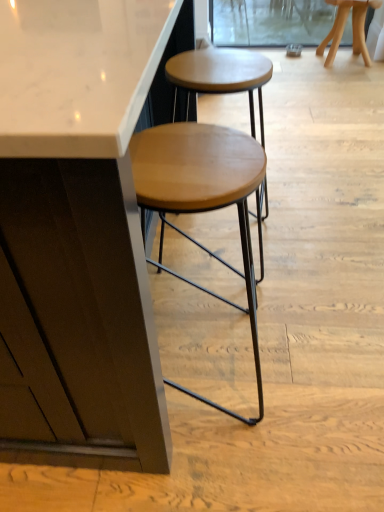
The width and height of the screenshot is (384, 512). Identify the location of vacant space in front of transparent glass screen door at upper center. (326, 82).